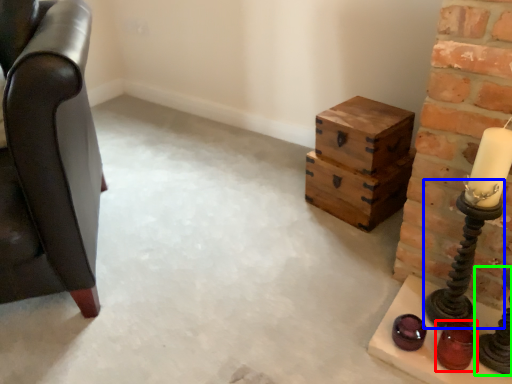
Question: Which is nearer to the candle holder (highlighted by a red box)? candle holder (highlighted by a blue box) or candle holder (highlighted by a green box).

Choices:
 (A) candle holder
 (B) candle holder

Answer: (B)